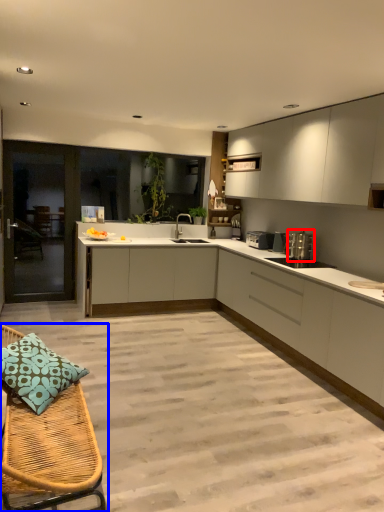
Question: Which object is further to the camera taking this photo, appliance (highlighted by a red box) or furniture (highlighted by a blue box)?

Choices:
 (A) appliance
 (B) furniture

Answer: (A)